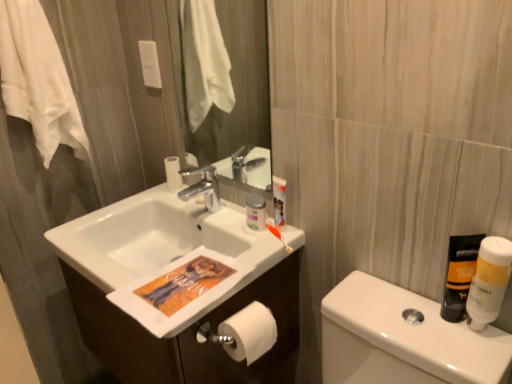
Question: From a real-world perspective, is white cotton towel at upper left under white glossy cabinet at center?

Choices:
 (A) yes
 (B) no

Answer: (B)

Question: Is white cotton towel at upper left taller than white glossy cabinet at center?

Choices:
 (A) yes
 (B) no

Answer: (A)

Question: Does white cotton towel at upper left appear on the right side of white glossy cabinet at center?

Choices:
 (A) no
 (B) yes

Answer: (A)

Question: Is white cotton towel at upper left looking in the opposite direction of white glossy cabinet at center?

Choices:
 (A) yes
 (B) no

Answer: (B)

Question: Is white cotton towel at upper left further to the viewer compared to white glossy cabinet at center?

Choices:
 (A) yes
 (B) no

Answer: (A)

Question: Do you think white glossy toilet paper at lower left is within white matte bottle at right, which is counted as the first mouthwash, starting from the right, or outside of it?

Choices:
 (A) outside
 (B) inside

Answer: (A)

Question: Is white glossy toilet paper at lower left bigger or smaller than white matte bottle at right, which is counted as the first mouthwash, starting from the right?

Choices:
 (A) small
 (B) big

Answer: (B)

Question: From the image's perspective, is white glossy toilet paper at lower left above or below white matte bottle at right, arranged as the 2th mouthwash when viewed from the left?

Choices:
 (A) above
 (B) below

Answer: (B)

Question: From a real-world perspective, is white glossy toilet paper at lower left physically located above or below white matte bottle at right, which is counted as the first mouthwash, starting from the right?

Choices:
 (A) below
 (B) above

Answer: (A)

Question: From the image's perspective, is white matte bottle at right, arranged as the 2th mouthwash when viewed from the left, positioned above or below white glossy toilet paper at lower left?

Choices:
 (A) above
 (B) below

Answer: (A)

Question: Based on their sizes in the image, would you say white matte bottle at right, which is counted as the first mouthwash, starting from the right, is bigger or smaller than white glossy toilet paper at lower left?

Choices:
 (A) big
 (B) small

Answer: (B)

Question: Does point (508, 271) appear closer or farther from the camera than point (381, 319)?

Choices:
 (A) farther
 (B) closer

Answer: (B)

Question: Which is correct: white matte bottle at right, which is counted as the first mouthwash, starting from the right, is inside white glossy toilet paper at lower left, or outside of it?

Choices:
 (A) outside
 (B) inside

Answer: (A)

Question: From their relative heights in the image, would you say white matte bottle at right, which is counted as the first mouthwash, starting from the right, is taller or shorter than translucent plastic bottle at right, the first mouthwash when ordered from left to right?

Choices:
 (A) tall
 (B) short

Answer: (A)

Question: Is white matte bottle at right, which is counted as the first mouthwash, starting from the right, in front of or behind translucent plastic bottle at right, which appears as the 2th mouthwash when viewed from the right, in the image?

Choices:
 (A) behind
 (B) front

Answer: (B)